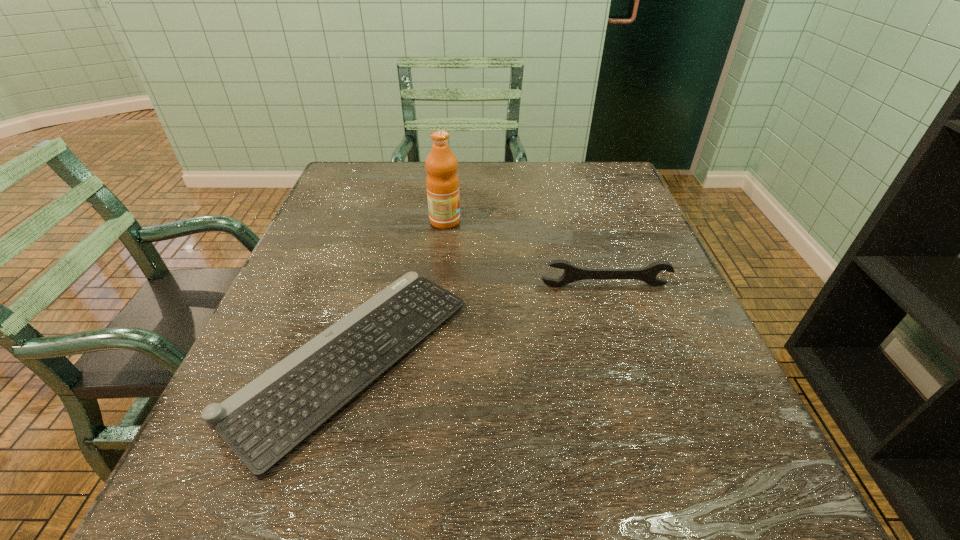
Where is `the tallest object`? The height and width of the screenshot is (540, 960). the tallest object is located at coordinates (442, 182).

You are a GUI agent. You are given a task and a screenshot of the screen. Output one action in this format:
    pyautogui.click(x=<x>, y=<y>)
    Task: Click on the farthest object
    
    Given the screenshot: What is the action you would take?
    pyautogui.click(x=442, y=182)

Identify the location of wrench. (572, 273).

Locate an element on the screen. This screenshot has height=540, width=960. the rightmost object is located at coordinates (572, 273).

This screenshot has height=540, width=960. In order to click on computer keyboard in this screenshot , I will do `click(264, 421)`.

Image resolution: width=960 pixels, height=540 pixels. Find the location of `free space located on the label side of the fruit juice`. free space located on the label side of the fruit juice is located at coordinates (551, 221).

Image resolution: width=960 pixels, height=540 pixels. Identify the location of free region located on the open ends of the rightmost object. (629, 362).

What are the coordinates of `vacant space located 0.090m on the right of the shortest object` in the screenshot? It's located at (515, 357).

Where is `object positioned at the near edge`? The height and width of the screenshot is (540, 960). object positioned at the near edge is located at coordinates (264, 421).

Image resolution: width=960 pixels, height=540 pixels. In order to click on object at the left edge in this screenshot , I will do `click(264, 421)`.